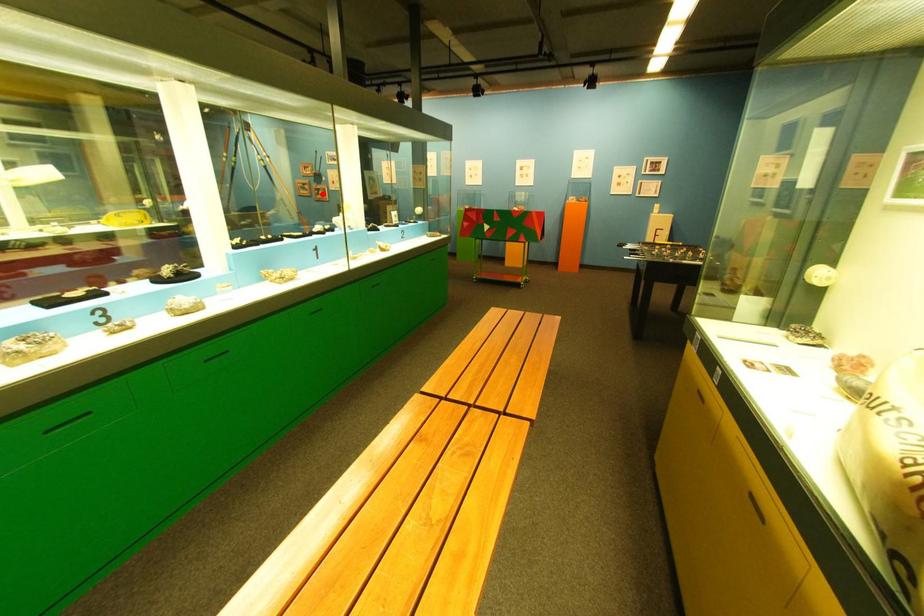
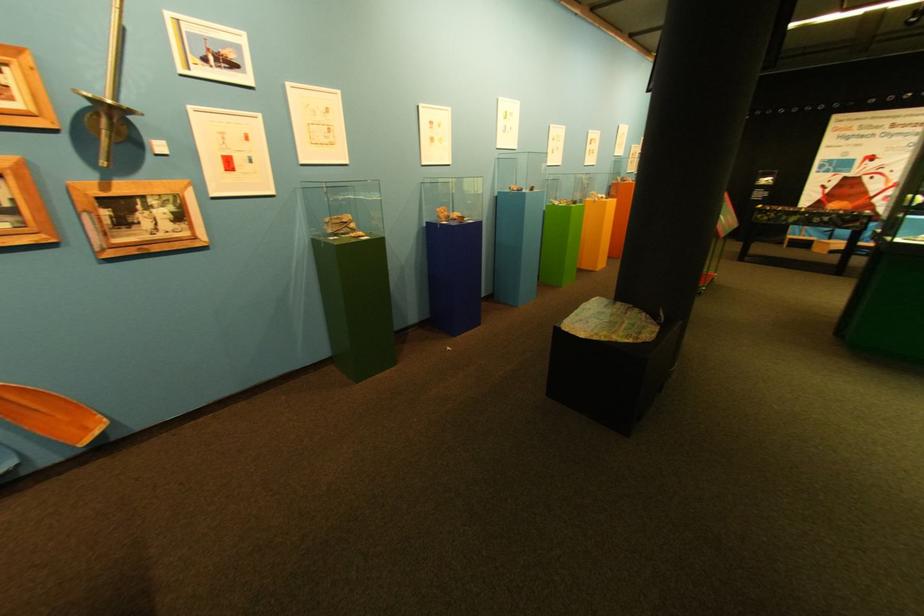
Find the pixel in the second image that matches the highlighted location in the first image.

(18, 228)